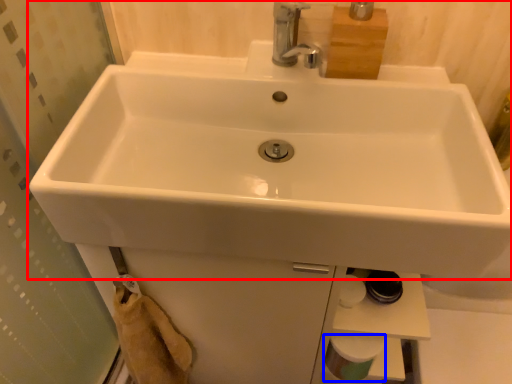
Question: Which object appears closest to the camera in this image, sink (highlighted by a red box) or toilet paper (highlighted by a blue box)?

Choices:
 (A) sink
 (B) toilet paper

Answer: (A)